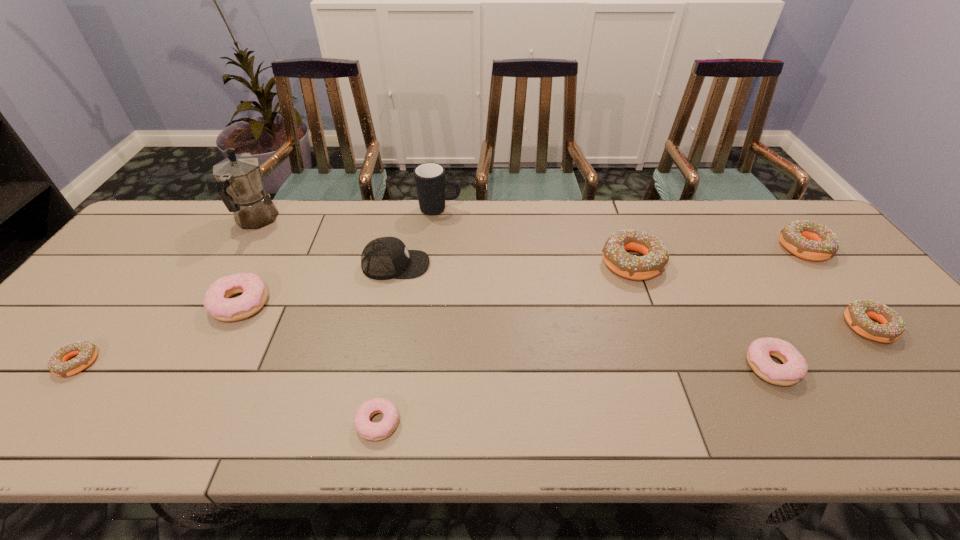
Locate an element on the screen. the tallest object is located at coordinates (240, 186).

The image size is (960, 540). I want to click on the ninth shortest object, so click(430, 180).

At what (x,y) coordinates should I click in order to perform the action: click on cap. Please return your answer as a coordinate pair (x, y). The width and height of the screenshot is (960, 540). Looking at the image, I should click on (384, 258).

This screenshot has width=960, height=540. I want to click on the seventh shortest object, so click(x=656, y=256).

Find the location of a particular element. The image size is (960, 540). the second chocolate doughnut from left to right is located at coordinates (656, 256).

Image resolution: width=960 pixels, height=540 pixels. I want to click on the third smallest chocolate doughnut, so click(808, 240).

Locate an element on the screen. the farthest pink doughnut is located at coordinates (216, 301).

What are the coordinates of `the biggest pink doughnut` in the screenshot? It's located at (216, 301).

What are the coordinates of `the second nearest chocolate doughnut` in the screenshot? It's located at (857, 314).

Where is `the second biggest pink doughnut`? The width and height of the screenshot is (960, 540). the second biggest pink doughnut is located at coordinates (794, 368).